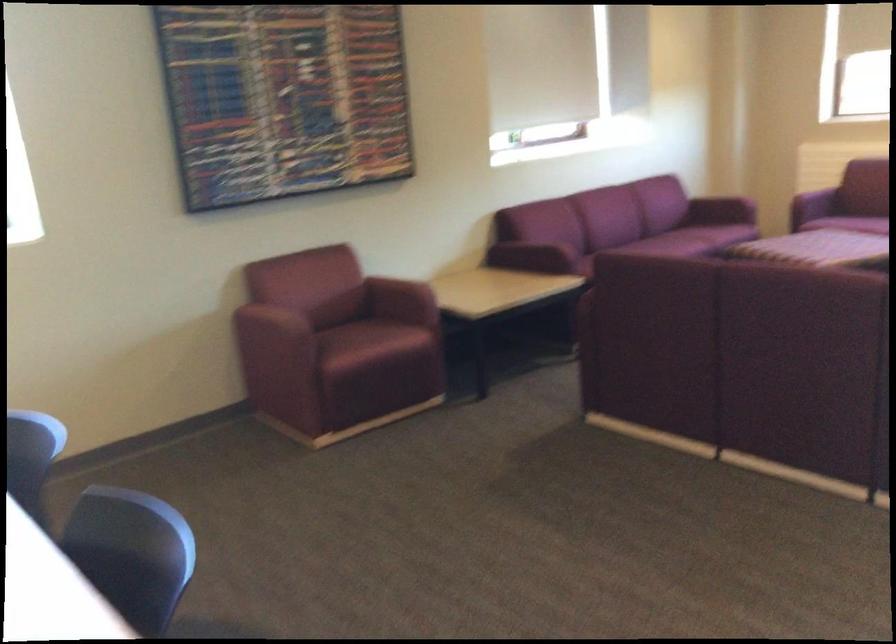
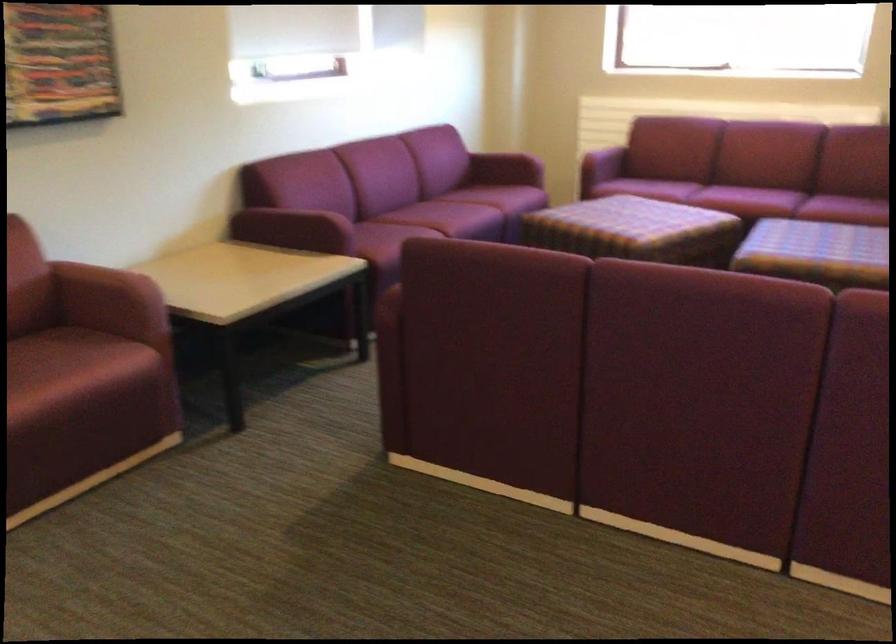
Question: The first image is from the beginning of the video and the second image is from the end. How did the camera likely rotate when shooting the video?

Choices:
 (A) Left
 (B) Right
 (C) Up
 (D) Down

Answer: (B)